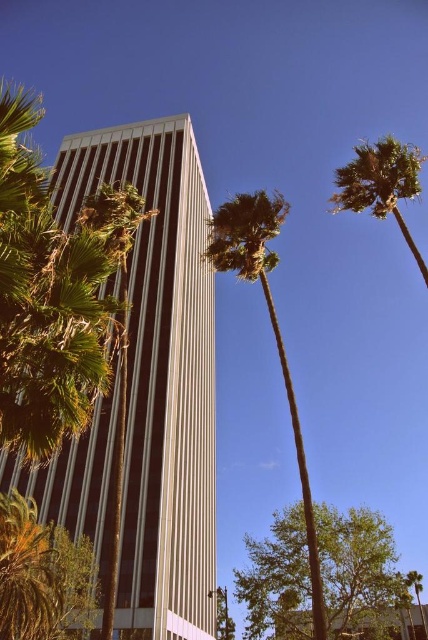
You are standing at the point with coordinates (359,573) in the image. What object are you directly facing? Please refer to the scene description for context.

The point at (359,573) is directly facing the green leafy tree at center as described in the scene.

You are standing in the urban scene and want to walk towards the green leafy tree at center and the green leafy tree at lower left. Which tree will you reach first?

You will reach the green leafy tree at center first because it is closer to you than the green leafy tree at lower left, which is further away.